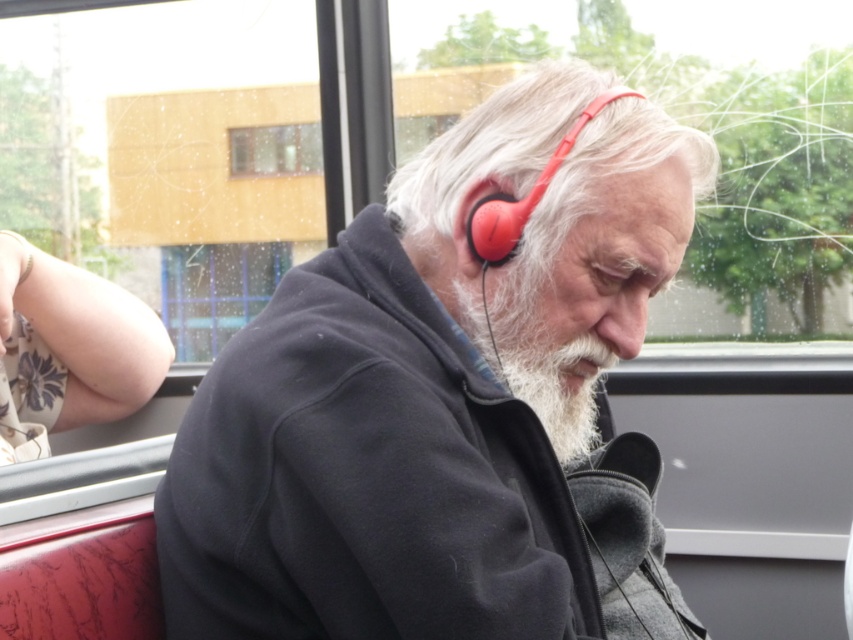
You are a passenger on a bus and you want to check if your matte red earphone at upper center can fit through the gap between the clear glass window at upper center and its frame. Can it fit?

The matte red earphone at upper center is thinner than the clear glass window at upper center, so it can fit through the gap.

You are a passenger on a bus and see the matte red earphone at upper center and the clear glass window at upper center. Which object is positioned lower in the image?

The matte red earphone at upper center is located below the clear glass window at upper center, so it is positioned lower in the image.

You are a passenger on a bus and you see two points marked in the image. The first point is at coordinate point (579, 394) and the second is at point (291, 140). Which point is closer to you?

Point (579, 394) is closer to the camera than point (291, 140).